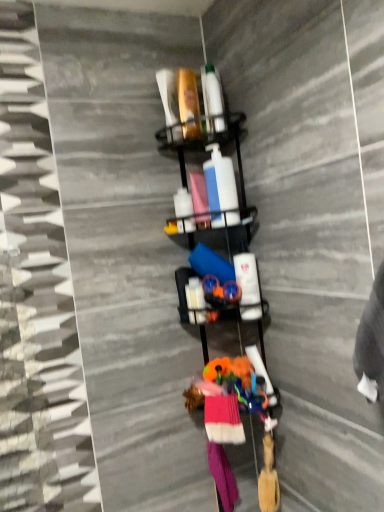
Question: From the image's perspective, relative to metallic black shelf at center, is knitted wool socks at center, the 2th clothing positioned from the back, above or below?

Choices:
 (A) above
 (B) below

Answer: (B)

Question: Is point (215, 411) positioned closer to the camera than point (188, 117)?

Choices:
 (A) farther
 (B) closer

Answer: (B)

Question: Estimate the real-world distances between objects in this image. Which object is closer to the metallic black shelf at center?

Choices:
 (A) pink fabric socks at lower center, which is counted as the first clothing, starting from the back
 (B) pink fabric at center
 (C) knitted wool socks at center, the 2th clothing positioned from the back

Answer: (B)

Question: Based on their relative distances, which object is nearer to the knitted wool socks at center, placed as the first clothing when sorted from top to bottom?

Choices:
 (A) pink fabric socks at lower center, the second clothing from the front
 (B) metallic black shelf at center
 (C) pink fabric at center

Answer: (A)